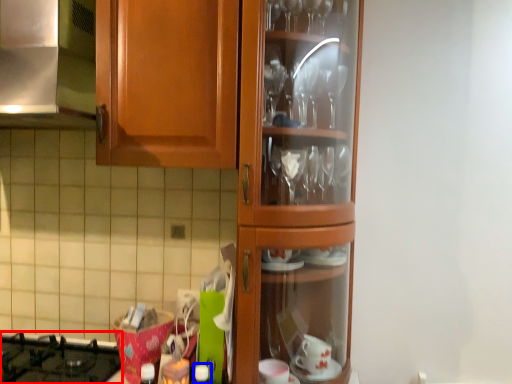
Question: Among these objects, which one is farthest to the camera, gas stove (highlighted by a red box) or bottle (highlighted by a blue box)?

Choices:
 (A) gas stove
 (B) bottle

Answer: (A)